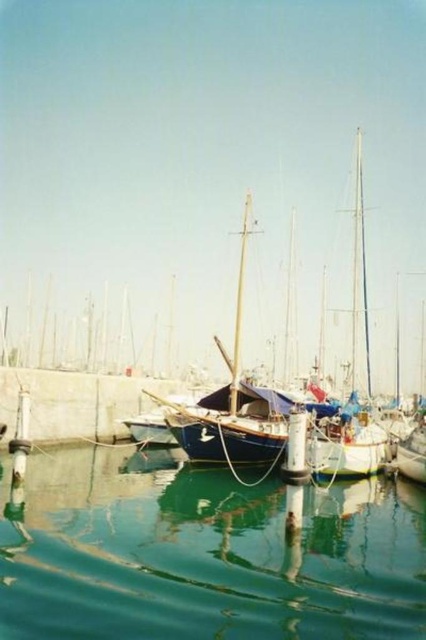
Is green reflective water at center in front of blue canvas sailboat at center?

Yes.

Is green reflective water at center to the right of blue canvas sailboat at center from the viewer's perspective?

No, green reflective water at center is not to the right of blue canvas sailboat at center.

I want to click on green reflective water at center, so click(x=206, y=554).